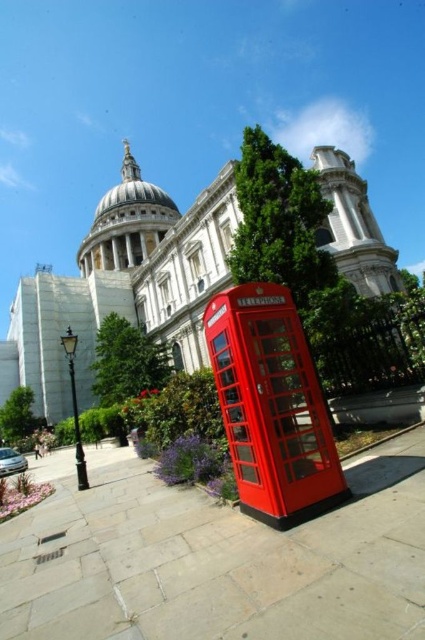
Is slate gray paving stone at lower center positioned at the back of glossy red telephone box at lower center?

No, it is not.

Is point (112, 532) less distant than point (263, 381)?

No, it is behind (263, 381).

Identify the location of slate gray paving stone at lower center. (215, 557).